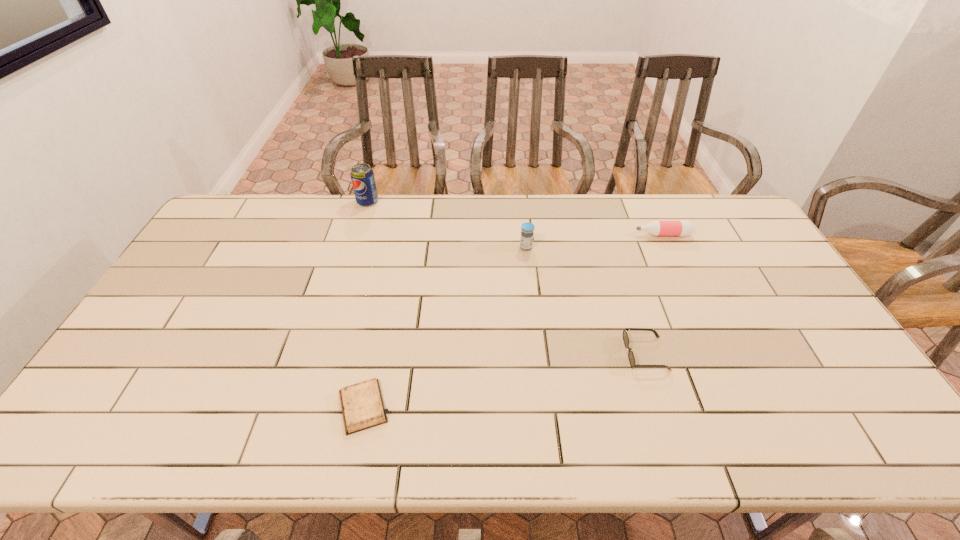
Where is `free space located 0.400m on the right of the farthest object`? free space located 0.400m on the right of the farthest object is located at coordinates (486, 201).

This screenshot has height=540, width=960. What are the coordinates of `free region located on the back of the second tallest object` in the screenshot? It's located at (521, 210).

Locate an element on the screen. This screenshot has width=960, height=540. free space located 0.370m with the cap open on the rightmost object is located at coordinates (527, 235).

Locate an element on the screen. The height and width of the screenshot is (540, 960). vacant space located 0.120m with the cap open on the rightmost object is located at coordinates (599, 235).

Identify the location of vacant space located with the cap open on the rightmost object. (567, 235).

At what (x,y) coordinates should I click in order to perform the action: click on vacant region located 0.140m on the front-facing side of the second shortest object. Please return your answer as a coordinate pair (x, y). Looking at the image, I should click on (572, 353).

Find the location of a particular element. This screenshot has width=960, height=540. vacant space located 0.380m on the front-facing side of the second shortest object is located at coordinates (482, 353).

Identify the location of free region located on the front-facing side of the second shortest object. The image size is (960, 540). (478, 353).

Identify the location of vacant space situated on the back of the shortest object. [380, 324].

Find the location of a particular element. This screenshot has width=960, height=540. soda present at the far edge is located at coordinates (362, 176).